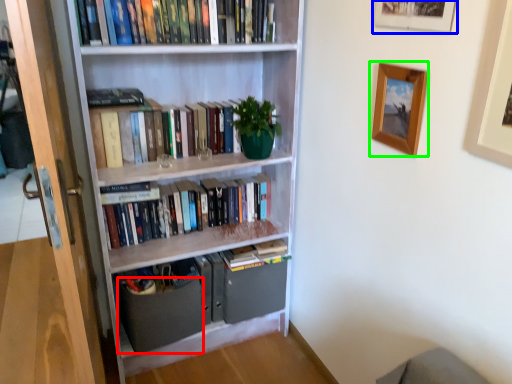
Question: Which object is the farthest from drawer (highlighted by a red box)? Choose among these: picture frame (highlighted by a blue box) or picture frame (highlighted by a green box).

Choices:
 (A) picture frame
 (B) picture frame

Answer: (A)